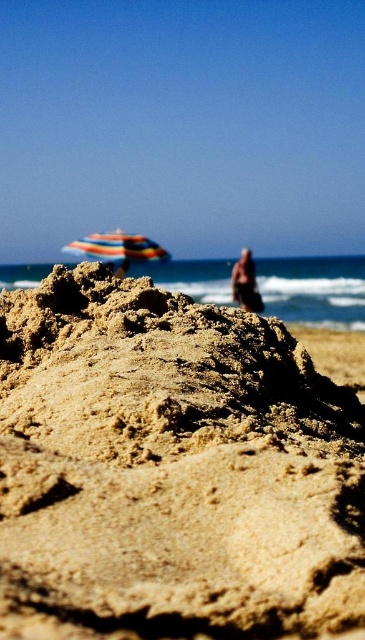
Question: Is fine-grained sand mound at center to the right of smooth tan skin at upper right from the viewer's perspective?

Choices:
 (A) yes
 (B) no

Answer: (B)

Question: Is striped fabric umbrella at upper center to the right of multicolored fabric umbrella at upper center from the viewer's perspective?

Choices:
 (A) no
 (B) yes

Answer: (A)

Question: Among these objects, which one is nearest to the camera?

Choices:
 (A) striped fabric umbrella at upper center
 (B) fine-grained sand mound at center

Answer: (B)

Question: Which point appears farthest from the camera in this image?

Choices:
 (A) (123, 273)
 (B) (255, 300)
 (C) (140, 632)

Answer: (A)

Question: Does striped fabric umbrella at upper center have a smaller size compared to multicolored fabric umbrella at upper center?

Choices:
 (A) no
 (B) yes

Answer: (B)

Question: Based on their relative distances, which object is farther from the smooth tan skin at upper right?

Choices:
 (A) striped fabric umbrella at upper center
 (B) fine-grained sand mound at center

Answer: (B)